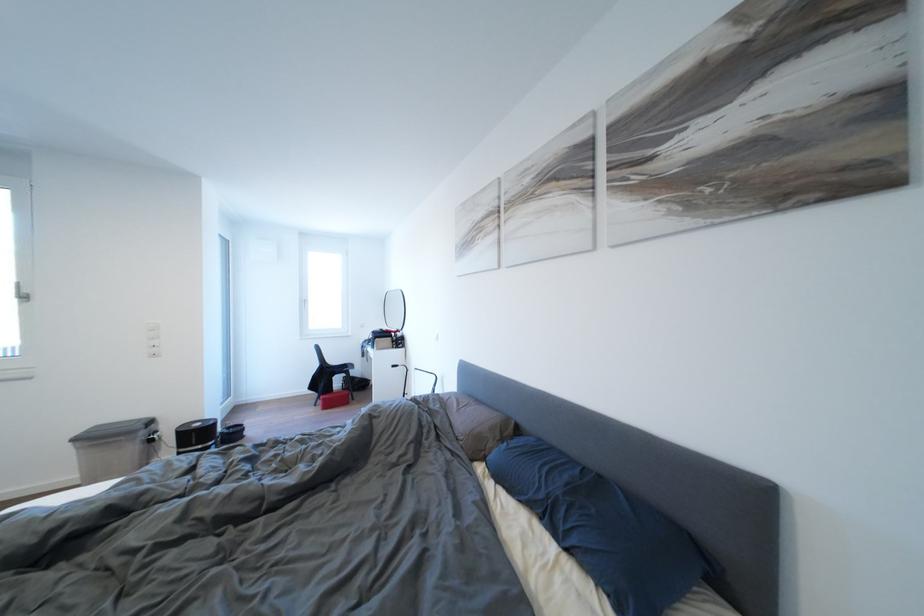
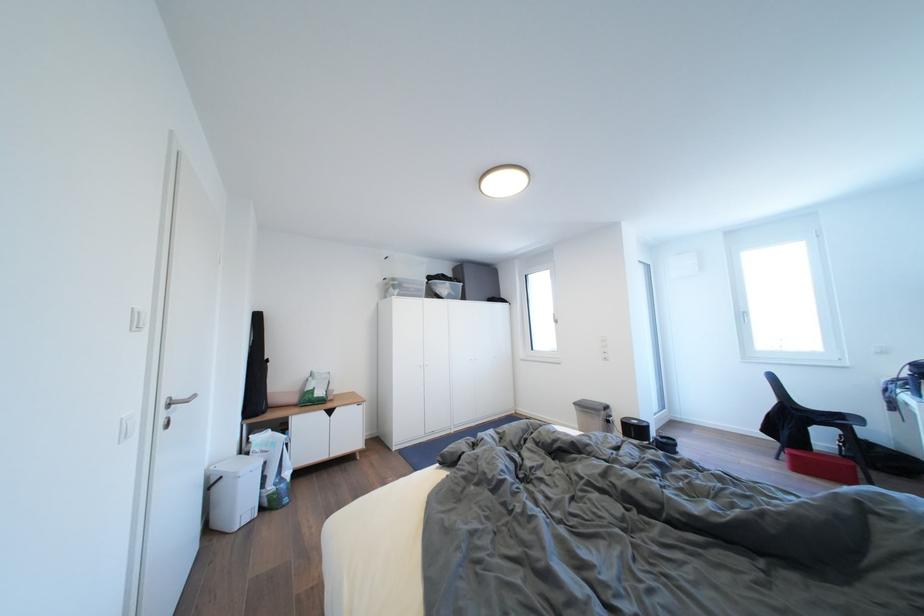
Question: The first image is from the beginning of the video and the second image is from the end. How did the camera likely rotate when shooting the video?

Choices:
 (A) Left
 (B) Right
 (C) Up
 (D) Down

Answer: (A)